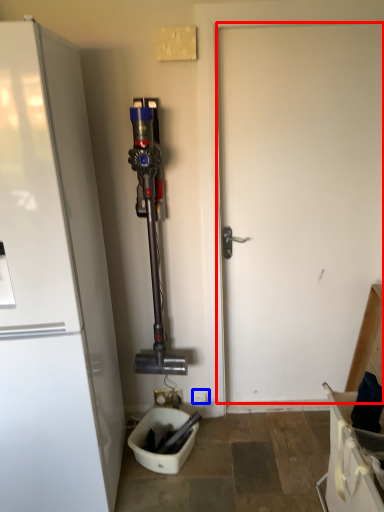
Question: Among these objects, which one is farthest to the camera, door (highlighted by a red box) or electric outlet (highlighted by a blue box)?

Choices:
 (A) door
 (B) electric outlet

Answer: (B)